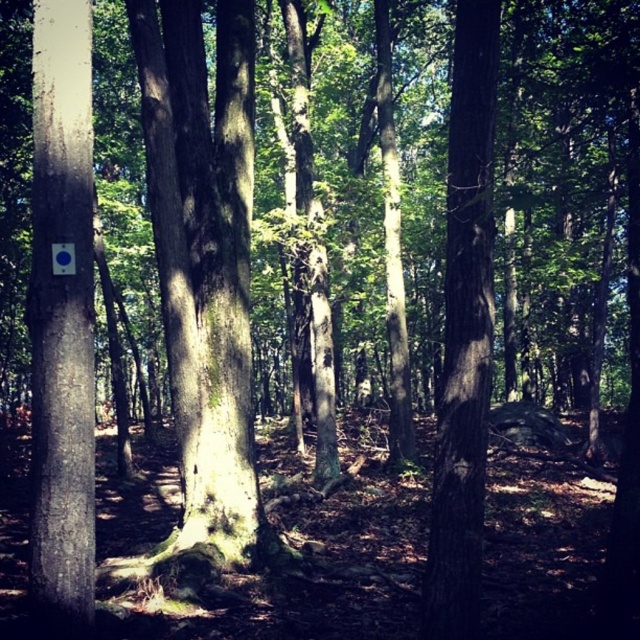
Question: Which point is closer to the camera taking this photo?

Choices:
 (A) (32, 60)
 (B) (481, 13)

Answer: (B)

Question: Is smooth gray bark at left to the right of smooth brown tree trunk at center from the viewer's perspective?

Choices:
 (A) no
 (B) yes

Answer: (A)

Question: Can you confirm if smooth gray bark at left is positioned to the right of smooth brown tree trunk at center?

Choices:
 (A) no
 (B) yes

Answer: (A)

Question: Is smooth gray bark at left to the left of smooth brown tree trunk at center from the viewer's perspective?

Choices:
 (A) no
 (B) yes

Answer: (B)